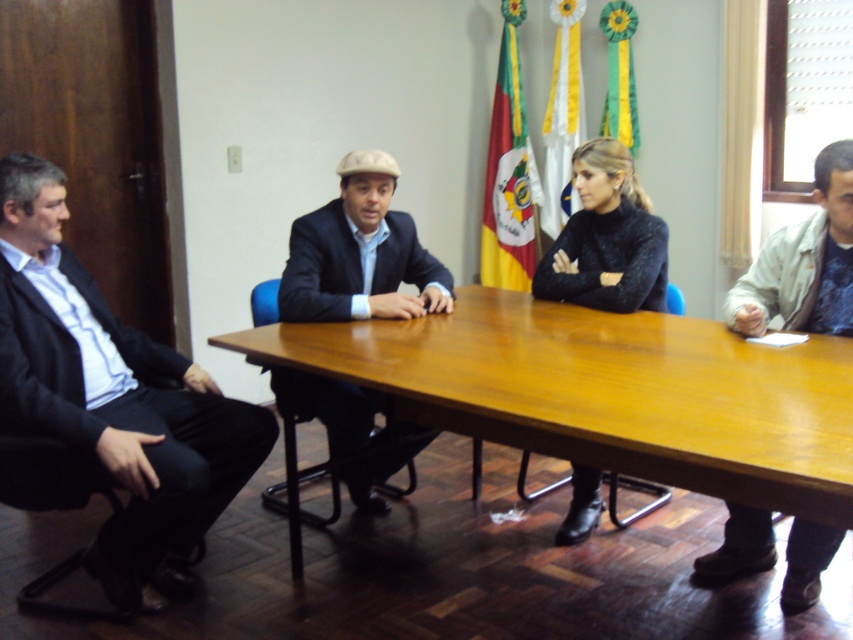
Question: Which point is farther to the camera?

Choices:
 (A) (505, 330)
 (B) (827, 166)
 (C) (0, 224)
 (D) (286, 316)

Answer: (D)

Question: Which of these objects is positioned closest to the dark blue suit at center?

Choices:
 (A) dark blue suit at left
 (B) light beige jacket at right
 (C) black fuzzy sweater at center
 (D) wooden at center

Answer: (D)

Question: Is dark blue suit at left closer to the viewer compared to black fuzzy sweater at center?

Choices:
 (A) yes
 (B) no

Answer: (A)

Question: Which object is closer to the camera taking this photo?

Choices:
 (A) dark blue suit at left
 (B) light beige jacket at right

Answer: (A)

Question: Is dark blue suit at center positioned behind black fuzzy sweater at center?

Choices:
 (A) yes
 (B) no

Answer: (B)

Question: Can you confirm if wooden at center is positioned to the right of dark blue suit at left?

Choices:
 (A) no
 (B) yes

Answer: (B)